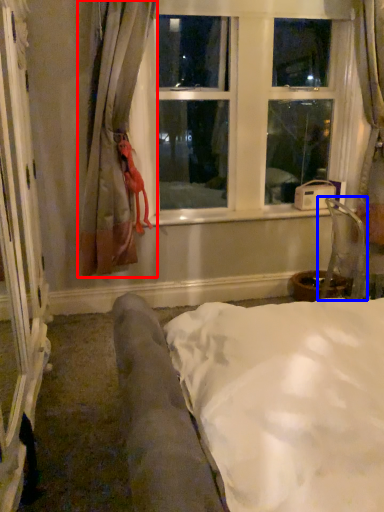
Question: Which point is closer to the camera, curtain (highlighted by a red box) or armchair (highlighted by a blue box)?

Choices:
 (A) curtain
 (B) armchair

Answer: (A)